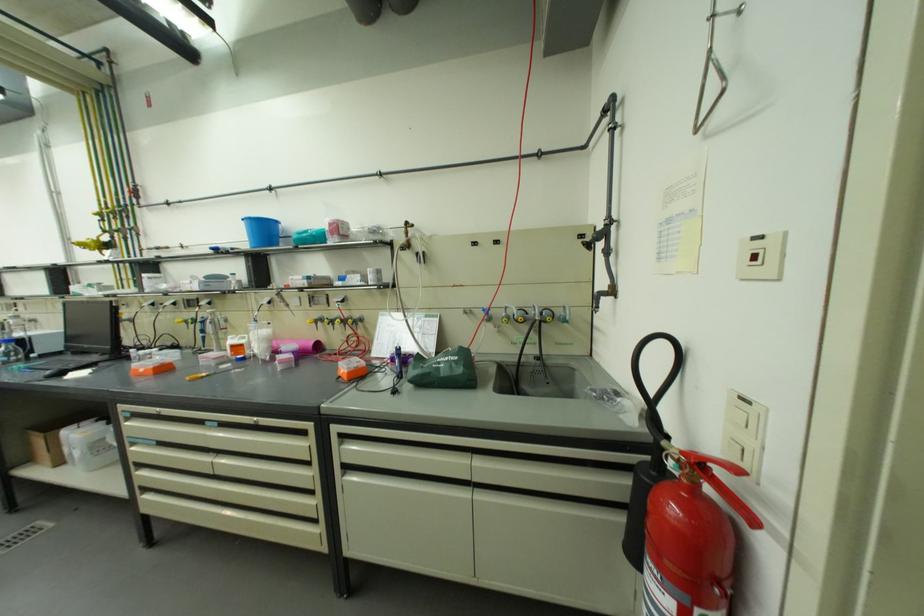
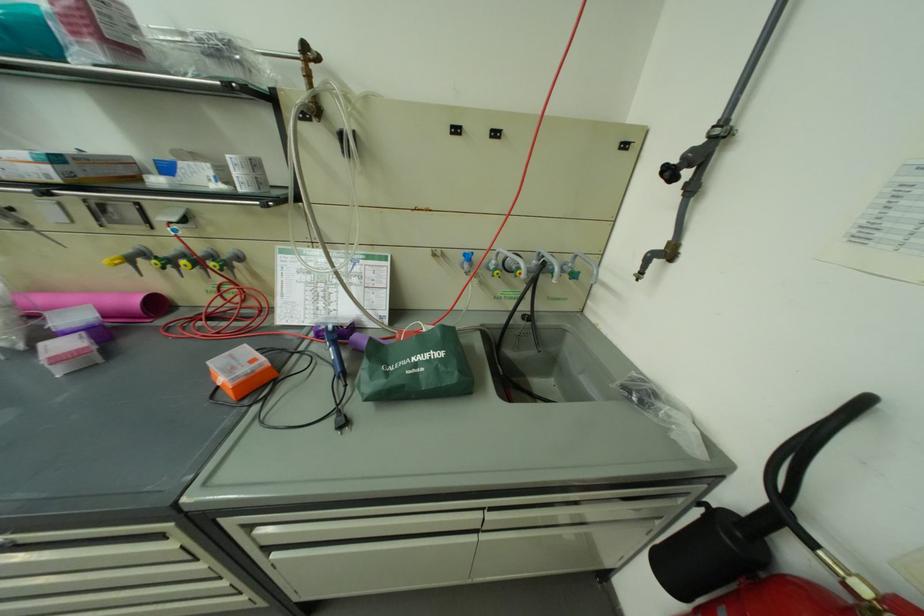
Question: What movement of the cameraman would produce the second image?

Choices:
 (A) Left
 (B) Right
 (C) Forward
 (D) Backward

Answer: (C)